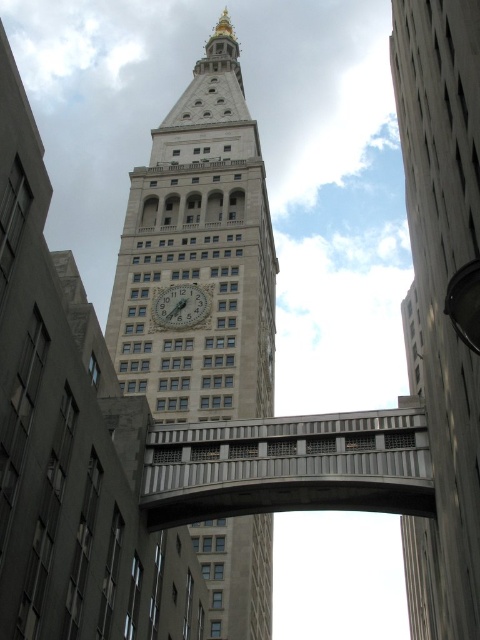
Question: Which point is closer to the camera?

Choices:
 (A) gold metallic clock at center
 (B) concrete bridge at center

Answer: (B)

Question: Is the position of concrete bridge at center less distant than that of gold metallic clock at center?

Choices:
 (A) no
 (B) yes

Answer: (B)

Question: Is gray concrete tower at center smaller than concrete bridge at center?

Choices:
 (A) yes
 (B) no

Answer: (B)

Question: Which object appears closest to the camera in this image?

Choices:
 (A) beige stone clock tower at center
 (B) concrete bridge at center

Answer: (B)

Question: Observing the image, what is the correct spatial positioning of gray concrete tower at center in reference to gold metallic clock at center?

Choices:
 (A) left
 (B) right

Answer: (B)

Question: Which of the following is the farthest from the observer?

Choices:
 (A) gold metallic clock at center
 (B) gray concrete tower at center

Answer: (A)